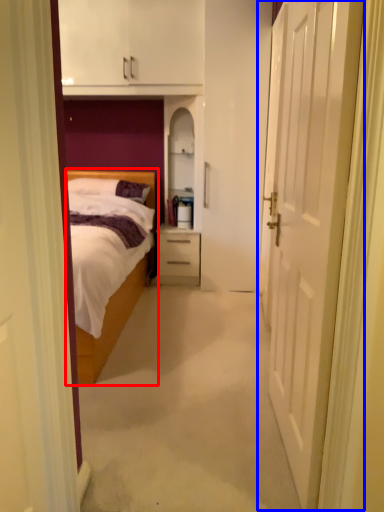
Question: Which object appears farthest to the camera in this image, bed (highlighted by a red box) or door (highlighted by a blue box)?

Choices:
 (A) bed
 (B) door

Answer: (A)